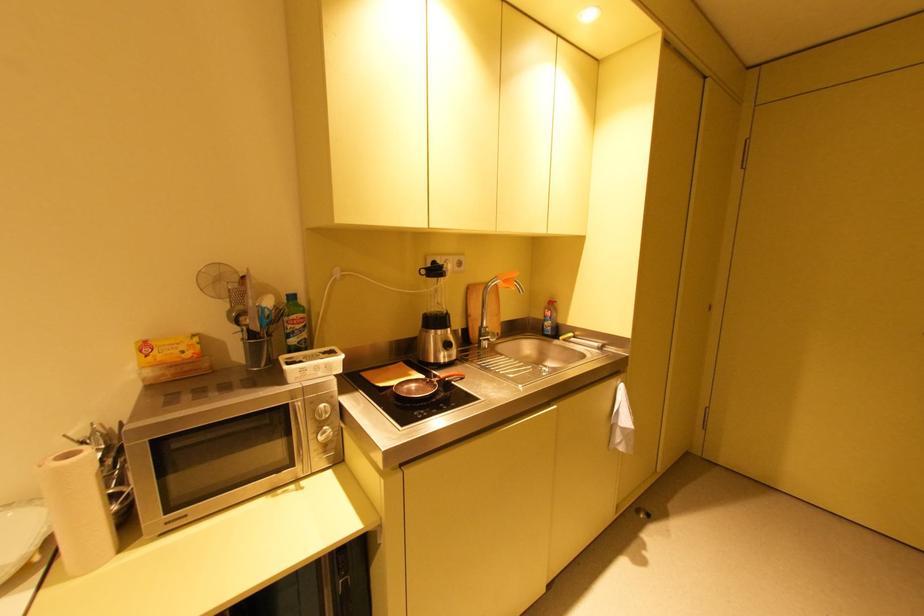
What are the coordinates of `blender pitcher` in the screenshot? It's located at (432, 344).